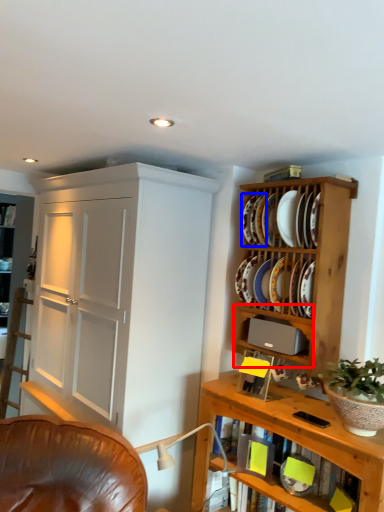
Question: Which of the following is the farthest to the observer, cabinet (highlighted by a red box) or platter (highlighted by a blue box)?

Choices:
 (A) cabinet
 (B) platter

Answer: (B)